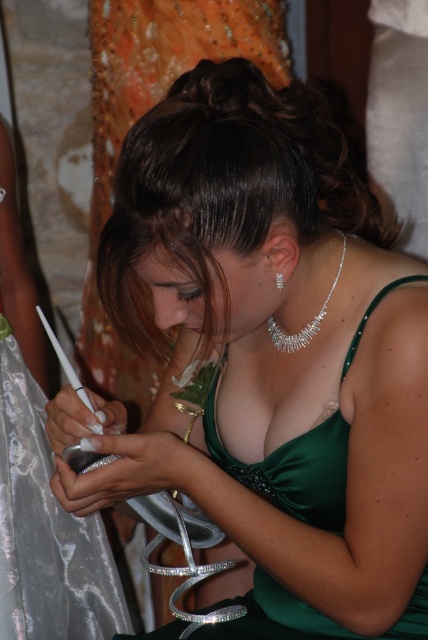
You are a fashion designer who needs to decide which item to showcase first in a catalog. The silver metallic dress at lower left and the silver metallic necklace at center are both part of the collection. Based on their sizes, which item should you place in the main catalog photo?

The silver metallic dress at lower left is bigger than the silver metallic necklace at center, so it should be placed in the main catalog photo as the focal point due to its larger size.

You are an interior designer working on a layout for a room. You need to place a sofa in the room such that it is 2 meters away from the silver metallic dress at lower left. Where should you place the sofa?

The silver metallic dress at lower left is located at coordinates [45,529]. To place the sofa 2 meters away from this point, you would need to calculate the coordinates based on the room dimensions and scale, but since specific room dimensions are not provided, the exact placement cannot be determined. However, the sofa should be positioned at a distance of 2 meters from the point [45,529] in the room layout.